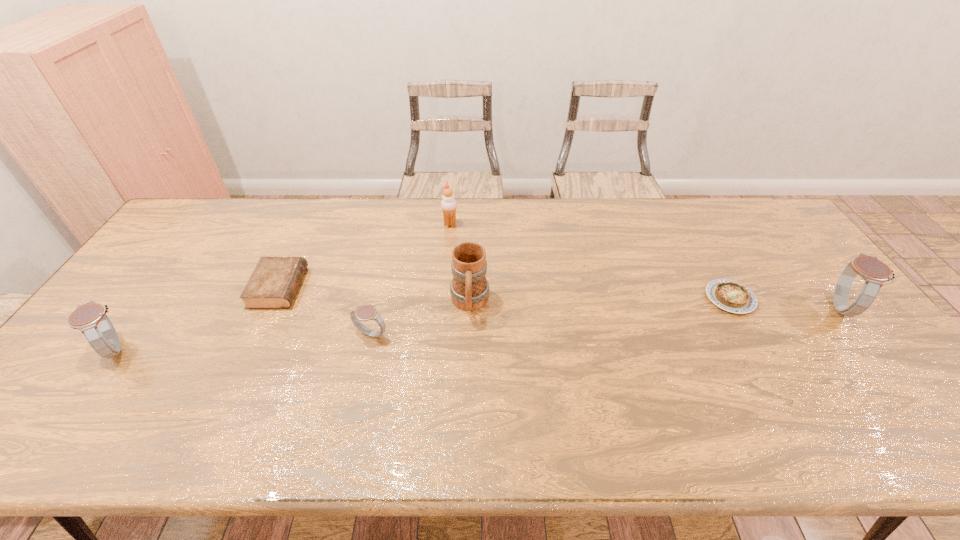
This screenshot has width=960, height=540. I want to click on mug, so click(469, 288).

Locate an element on the screen. This screenshot has width=960, height=540. free space located 0.050m on the front of the leftmost watch is located at coordinates (87, 388).

Locate an element on the screen. Image resolution: width=960 pixels, height=540 pixels. free point located 0.290m on the right of the second watch from left to right is located at coordinates (499, 334).

The width and height of the screenshot is (960, 540). Find the location of `vacant space located on the back of the rightmost object`. vacant space located on the back of the rightmost object is located at coordinates (802, 259).

I want to click on vacant space located 0.230m at the front with a straw on the icecream, so click(525, 224).

You are a GUI agent. You are given a task and a screenshot of the screen. Output one action in this format:
    pyautogui.click(x=<x>, y=<y>)
    Task: Click on the free region located on the spine side of the second object from left to right
    This screenshot has height=540, width=960.
    Given the screenshot: What is the action you would take?
    pyautogui.click(x=373, y=287)

Where is `free space located 0.090m on the back of the quiche`? The height and width of the screenshot is (540, 960). free space located 0.090m on the back of the quiche is located at coordinates (709, 261).

I want to click on vacant space located on the side of the mug with the handle, so click(x=468, y=361).

Where is `object present at the far edge`? This screenshot has height=540, width=960. object present at the far edge is located at coordinates (448, 204).

The height and width of the screenshot is (540, 960). I want to click on object positioned at the left edge, so click(90, 318).